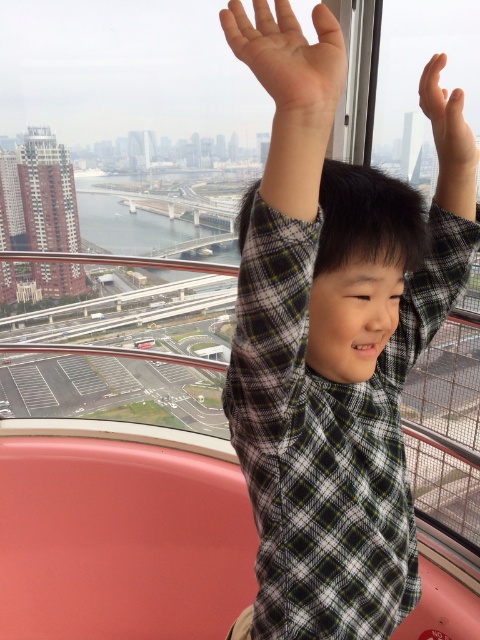
Find the location of a particular element. plaid fabric arm at upper right is located at coordinates (450, 141).

Who is lower down, plaid fabric arm at upper right or matte skin hand at upper right?

plaid fabric arm at upper right

Who is more distant from viewer, (453, 164) or (444, 100)?

The point (453, 164) is behind.

Identify the location of plaid fabric arm at upper right. (450, 141).

Does plaid shirt at center appear over plaid fabric arm at upper right?

Actually, plaid shirt at center is below plaid fabric arm at upper right.

Does plaid shirt at center appear on the right side of plaid fabric arm at upper right?

No, plaid shirt at center is not to the right of plaid fabric arm at upper right.

Who is more forward, (255, 65) or (444, 168)?

Positioned in front is point (255, 65).

You are a GUI agent. You are given a task and a screenshot of the screen. Output one action in this format:
    pyautogui.click(x=<x>, y=<y>)
    Task: Click on the plaid shirt at center
    The height and width of the screenshot is (640, 480).
    Given the screenshot: What is the action you would take?
    pyautogui.click(x=328, y=348)

Between plaid shirt at center and matte skin hand at upper right, which one appears on the right side from the viewer's perspective?

From the viewer's perspective, matte skin hand at upper right appears more on the right side.

Between point (372, 532) and point (454, 115), which one is positioned in front?

Positioned in front is point (454, 115).

Locate an element on the screen. The width and height of the screenshot is (480, 640). plaid shirt at center is located at coordinates (328, 348).